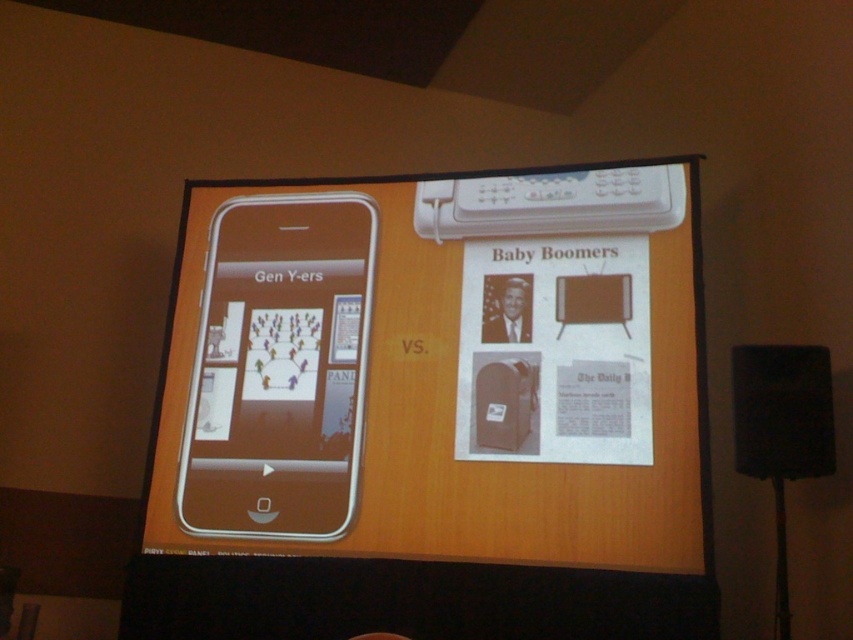
Question: Can you confirm if silver metallic phone at center is positioned above black matte speaker at lower right?

Choices:
 (A) yes
 (B) no

Answer: (A)

Question: Can you confirm if silver metallic phone at center is wider than black matte speaker at lower right?

Choices:
 (A) yes
 (B) no

Answer: (A)

Question: Among these objects, which one is farthest from the camera?

Choices:
 (A) black matte speaker at lower right
 (B) silver metallic phone at center

Answer: (B)

Question: Among these points, which one is farthest from the camera?

Choices:
 (A) (207, 452)
 (B) (759, 349)
 (C) (263, 268)

Answer: (C)

Question: Which object is farther from the camera taking this photo?

Choices:
 (A) silver metallic phone at center
 (B) black matte speaker at lower right

Answer: (A)

Question: Is silver metallic phone at left positioned before silver metallic phone at center?

Choices:
 (A) no
 (B) yes

Answer: (B)